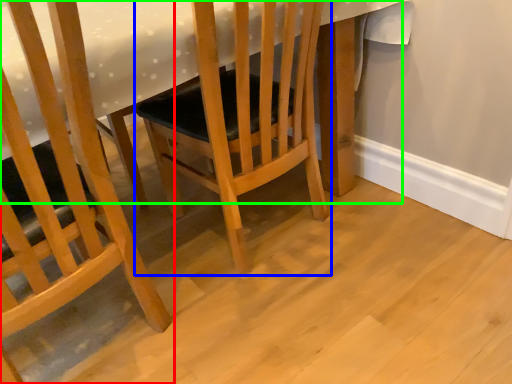
Question: Considering the real-world distances, which object is farthest from chair (highlighted by a red box)? chair (highlighted by a blue box) or table (highlighted by a green box)?

Choices:
 (A) chair
 (B) table

Answer: (A)